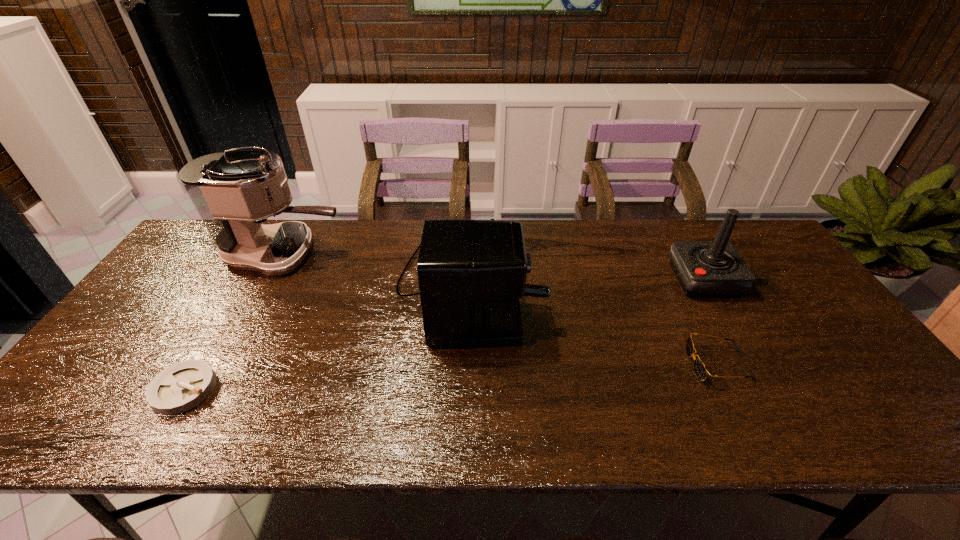
The image size is (960, 540). I want to click on vacant area located 0.120m on the front-facing side of the joystick, so click(634, 280).

You are a GUI agent. You are given a task and a screenshot of the screen. Output one action in this format:
    pyautogui.click(x=<x>, y=<y>)
    Task: Click on the vacant space located on the front-facing side of the joystick
    
    Given the screenshot: What is the action you would take?
    pyautogui.click(x=634, y=280)

Locate an element on the screen. This screenshot has width=960, height=540. free region located on the front-facing side of the sunglasses is located at coordinates (525, 364).

At what (x,y) coordinates should I click in order to perform the action: click on blank space located on the front-facing side of the sunglasses. Please return your answer as a coordinate pair (x, y). The image size is (960, 540). Looking at the image, I should click on (628, 364).

Where is `blank space located 0.140m on the front-facing side of the sunglasses`? The width and height of the screenshot is (960, 540). blank space located 0.140m on the front-facing side of the sunglasses is located at coordinates (632, 364).

Where is `vacant point located 0.210m on the back of the shortest object`? vacant point located 0.210m on the back of the shortest object is located at coordinates (234, 305).

Where is `joystick situated at the far edge`? The width and height of the screenshot is (960, 540). joystick situated at the far edge is located at coordinates (705, 269).

This screenshot has height=540, width=960. Identify the location of object that is at the near edge. (184, 385).

This screenshot has width=960, height=540. What are the coordinates of `object that is at the left edge` in the screenshot? It's located at (234, 192).

You are a GUI agent. You are given a task and a screenshot of the screen. Output one action in this format:
    pyautogui.click(x=<x>, y=<y>)
    Task: Click on the object present at the far left corner
    This screenshot has width=960, height=540.
    Given the screenshot: What is the action you would take?
    pyautogui.click(x=234, y=192)